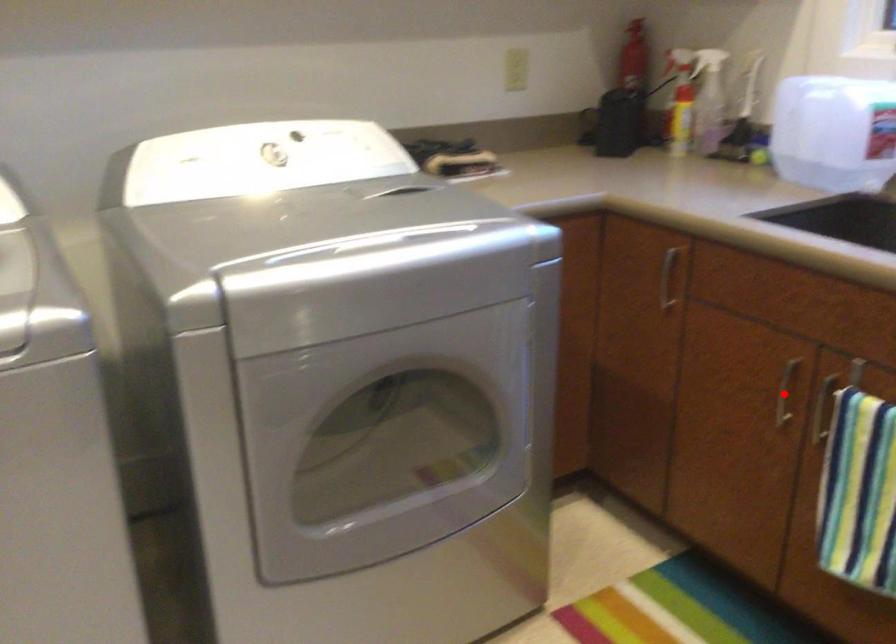
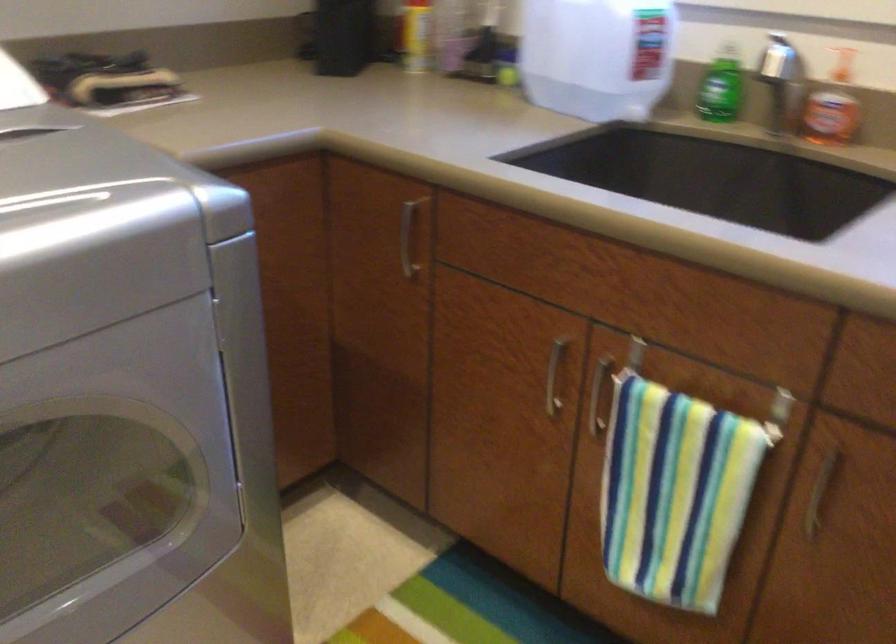
Question: I am providing you with two images of the same scene from different viewpoints. Given a red point in image1, look at the same physical point in image2. Is it:

Choices:
 (A) Closer to the viewpoint
 (B) Farther from the viewpoint

Answer: (A)